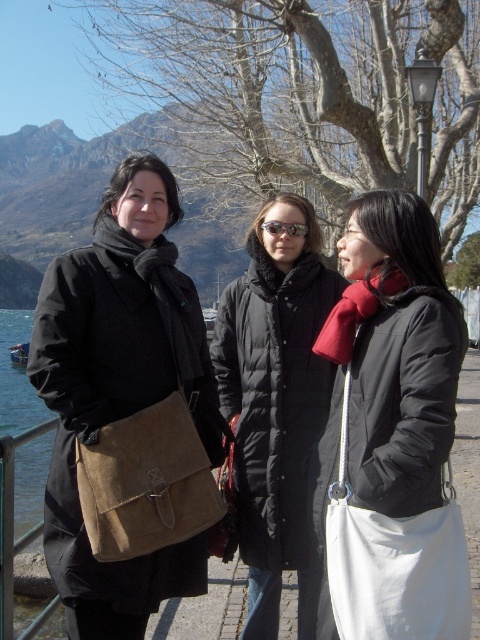
Question: Which object is farther from the camera taking this photo?

Choices:
 (A) matte black jacket at center
 (B) matte black coat at left
 (C) black puffy coat at center
 (D) reflective plastic goggles at center

Answer: (D)

Question: Observing the image, what is the correct spatial positioning of matte black jacket at center in reference to matte black coat at left?

Choices:
 (A) below
 (B) above

Answer: (A)

Question: Which of the following is the closest to the observer?

Choices:
 (A) matte black jacket at center
 (B) matte black coat at left
 (C) reflective plastic goggles at center
 (D) black puffy coat at center

Answer: (A)

Question: Does matte black jacket at center appear under black puffy coat at center?

Choices:
 (A) no
 (B) yes

Answer: (A)

Question: Which point is farther from the camera taking this photo?

Choices:
 (A) (299, 472)
 (B) (142, 310)
 (C) (41, 419)

Answer: (C)

Question: Considering the relative positions of blue water at left and metal/rustic rail at lower left in the image provided, where is blue water at left located with respect to metal/rustic rail at lower left?

Choices:
 (A) below
 (B) above

Answer: (B)